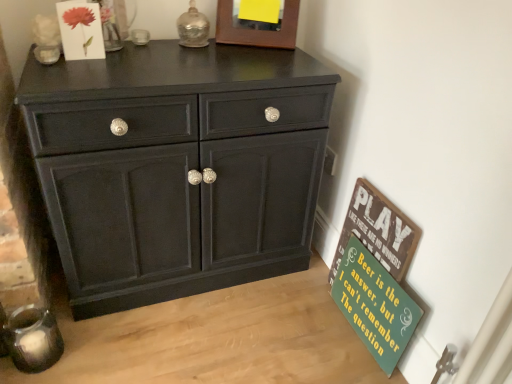
Question: Is green painted wood signboard at lower right, placed as the second bulletin board when sorted from bottom to top, to the right of green wood signboard at lower right, which is counted as the 1th bulletin board, starting from the bottom, from the viewer's perspective?

Choices:
 (A) no
 (B) yes

Answer: (A)

Question: From the image's perspective, is green painted wood signboard at lower right, placed as the second bulletin board when sorted from bottom to top, located above green wood signboard at lower right, the second bulletin board positioned from the top?

Choices:
 (A) no
 (B) yes

Answer: (B)

Question: Considering the relative sizes of green painted wood signboard at lower right, which ranks as the 1th bulletin board in top-to-bottom order, and green wood signboard at lower right, the second bulletin board positioned from the top, in the image provided, is green painted wood signboard at lower right, which ranks as the 1th bulletin board in top-to-bottom order, smaller than green wood signboard at lower right, the second bulletin board positioned from the top,?

Choices:
 (A) no
 (B) yes

Answer: (A)

Question: Is green painted wood signboard at lower right, which ranks as the 1th bulletin board in top-to-bottom order, positioned behind green wood signboard at lower right, which is counted as the 1th bulletin board, starting from the bottom?

Choices:
 (A) yes
 (B) no

Answer: (A)

Question: Is green painted wood signboard at lower right, placed as the second bulletin board when sorted from bottom to top, next to green wood signboard at lower right, the second bulletin board positioned from the top?

Choices:
 (A) yes
 (B) no

Answer: (B)

Question: Looking at their shapes, would you say wooden picture frame at upper center is wider or thinner than green wood signboard at lower right, the second bulletin board positioned from the top?

Choices:
 (A) thin
 (B) wide

Answer: (A)

Question: Is wooden picture frame at upper center taller or shorter than green wood signboard at lower right, the second bulletin board positioned from the top?

Choices:
 (A) short
 (B) tall

Answer: (A)

Question: Considering the positions of point (247, 33) and point (416, 307), is point (247, 33) closer or farther from the camera than point (416, 307)?

Choices:
 (A) closer
 (B) farther

Answer: (B)

Question: Which is correct: wooden picture frame at upper center is inside green wood signboard at lower right, which is counted as the 1th bulletin board, starting from the bottom, or outside of it?

Choices:
 (A) inside
 (B) outside

Answer: (B)

Question: From a real-world perspective, is matte paper flower at upper left positioned above or below wooden picture frame at upper center?

Choices:
 (A) above
 (B) below

Answer: (B)

Question: Is matte paper flower at upper left to the left or to the right of wooden picture frame at upper center in the image?

Choices:
 (A) left
 (B) right

Answer: (A)

Question: Based on their sizes in the image, would you say matte paper flower at upper left is bigger or smaller than wooden picture frame at upper center?

Choices:
 (A) big
 (B) small

Answer: (B)

Question: Is matte paper flower at upper left spatially inside wooden picture frame at upper center, or outside of it?

Choices:
 (A) outside
 (B) inside

Answer: (A)

Question: Is wooden picture frame at upper center inside the boundaries of matte paper flower at upper left, or outside?

Choices:
 (A) outside
 (B) inside

Answer: (A)

Question: From the image's perspective, relative to matte paper flower at upper left, is wooden picture frame at upper center above or below?

Choices:
 (A) below
 (B) above

Answer: (B)